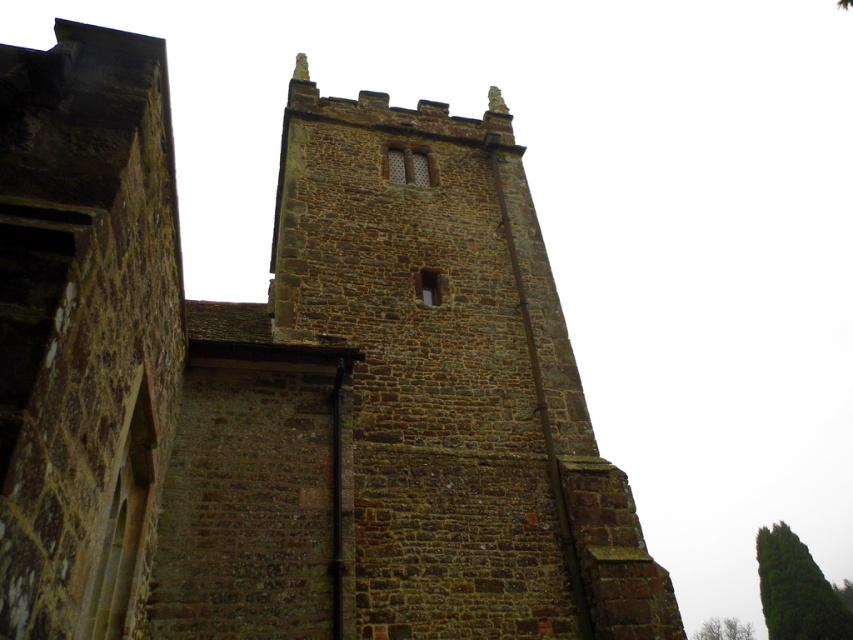
You are a drone operator trying to fly a drone between the two green leafy trees. The drone has a maximum flight distance of 60 meters. Based on the scene, can you determine if the drone can successfully fly from the green leafy tree at upper right to the green leafy tree at lower right without exceeding its range?

The green leafy tree at upper right is 59.12 meters from the green leafy tree at lower right, so yes, the drone can successfully fly between them as the distance is within its 60 meter range.